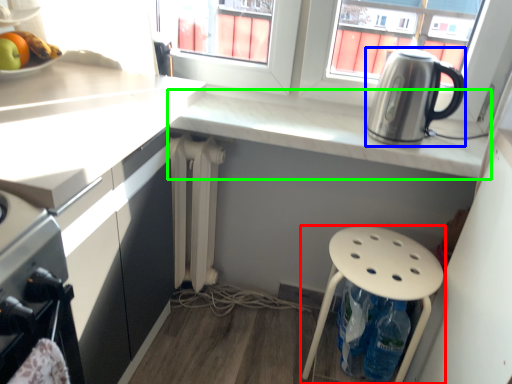
Question: Considering the real-world distances, which object is closest to stool (highlighted by a red box)? kitchen appliance (highlighted by a blue box) or countertop (highlighted by a green box).

Choices:
 (A) kitchen appliance
 (B) countertop

Answer: (B)